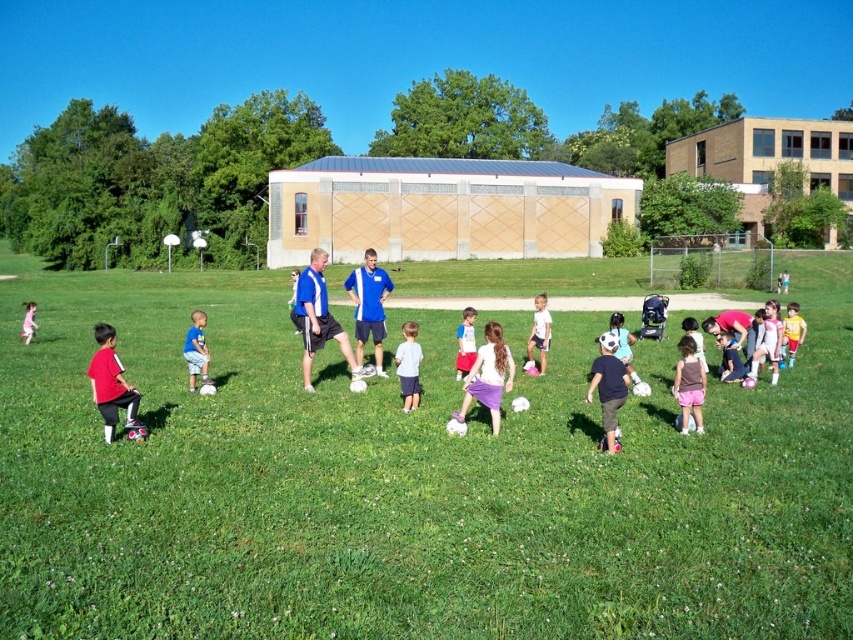
You are a photographer standing at the center of the field, and you want to take a photo that includes both the point at (457, 358) and the point at (291, 310). Which point is closer to your camera?

Point at (457, 358) is closer to the camera than point at (291, 310).

You are a photographer standing at the back of the field. You need to capture a photo that includes both the white cotton shirt at center and the blue jersey at center. Based on their positions, which one should you focus on first to ensure both are in frame?

The white cotton shirt at center is located below the blue jersey at center, so you should focus on the blue jersey at center first to ensure both are in frame.

You are a photographer standing at the edge of the field. You want to take a photo that includes both the matte red shirt at lower left and the purple satin skirt at center. What is the minimum distance you need to move backward to ensure both are in frame?

The minimum distance you need to move backward is 4.23 meters to ensure both the matte red shirt at lower left and the purple satin skirt at center are in frame.